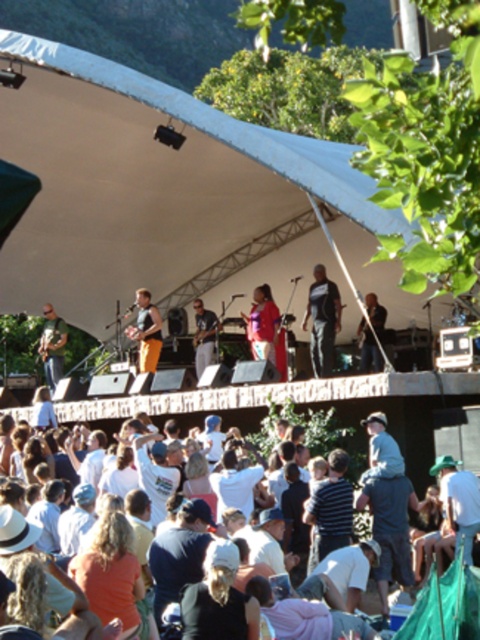
You are standing at the point labeled point (200, 349) and want to move to the stage. There is an obstacle at point (264, 323). Can you walk around it by moving towards the stage?

Point (264, 323) is closer to the camera than point (200, 349), so the obstacle at point (264, 323) is between you and the stage. Therefore, you cannot walk around it by moving towards the stage.

You are standing at the back of the concert venue and want to see the stage. There is a white cotton crowd at lower center and an orange cotton pants at center blocking your view. Which object is closer to you, making it harder to see the stage?

The white cotton crowd at lower center is closer to the viewer than orange cotton pants at center, so it is the closer object blocking your view.

You are a photographer positioned at the camera. You want to capture a closeup shot of the orange cotton pants at center. Given that your zoom lens can focus on subjects within 50 meters, will you be able to achieve this without moving closer?

The orange cotton pants at center is 70.88 meters away from the camera. Since the zoom lens can only focus within 50 meters, you cannot capture a closeup without moving closer.